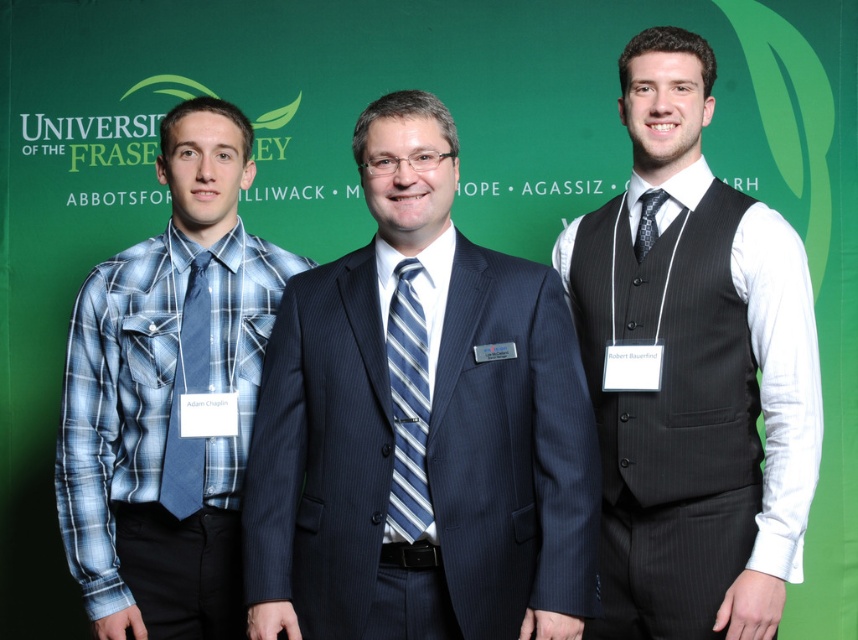
Looking at this image, you are organizing a photo shoot and need to ensure that all clothing items in the image are visible. Given that the dark blue pinstripe suit at center and the blue plaid shirt at left are part of the scene, which clothing item takes up more space in the image?

The blue plaid shirt at left takes up more space in the image than the dark blue pinstripe suit at center because the dark blue pinstripe suit at center occupies less space than blue plaid shirt at left.

You are attending a university event and notice two people wearing ties. The first is the person on the left wearing a blue plaid tie at left, and the second is the person in the center wearing a blue striped tie at center. Which tie is longer?

The blue plaid tie at left is longer than the blue striped tie at center.

Where is the blue striped tie at center located in the image?

The blue striped tie at center is located at point coordinates of (408, 406).